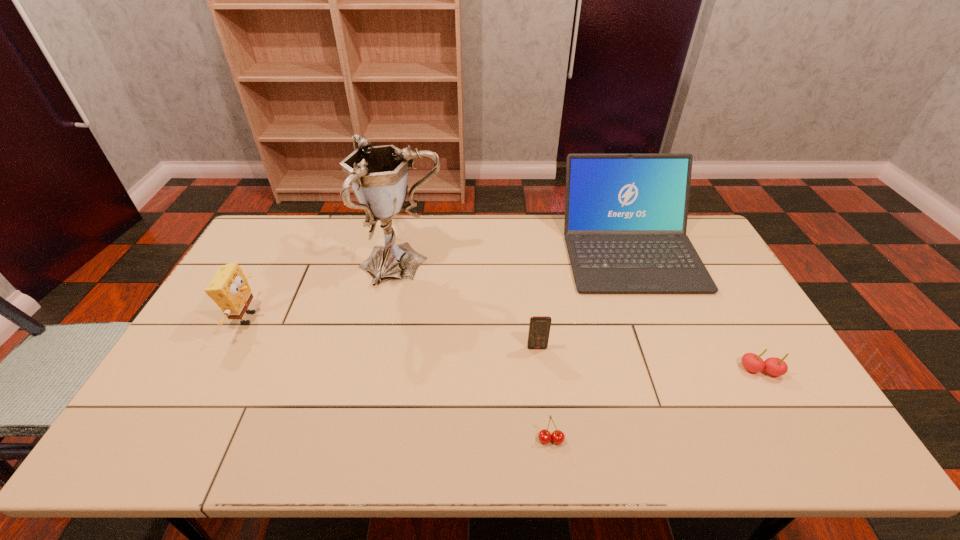
This screenshot has height=540, width=960. What are the coordinates of `free location located 0.170m on the right of the fifth object from right to left` in the screenshot? It's located at (496, 265).

This screenshot has width=960, height=540. Find the location of `free space located on the screen of the fifth shortest object`. free space located on the screen of the fifth shortest object is located at coordinates (660, 327).

You are a GUI agent. You are given a task and a screenshot of the screen. Output one action in this format:
    pyautogui.click(x=<x>, y=<y>)
    Task: Click on the vacant space located 0.360m on the face of the sponge
    
    Given the screenshot: What is the action you would take?
    pyautogui.click(x=384, y=318)

Identify the location of free spot located 0.180m on the screen of the cellular telephone. (544, 408).

This screenshot has width=960, height=540. What are the coordinates of `vacant region located on the left of the second nearest object` in the screenshot? It's located at (642, 370).

I want to click on trophy cup that is at the far edge, so click(x=378, y=175).

What are the coordinates of `laptop computer located at the far edge` in the screenshot? It's located at (625, 225).

Identify the location of object that is positioned at the near edge. The width and height of the screenshot is (960, 540). (545, 436).

Locate an element on the screen. This screenshot has width=960, height=540. object present at the left edge is located at coordinates (229, 289).

Where is `laptop computer that is at the right edge`? This screenshot has height=540, width=960. laptop computer that is at the right edge is located at coordinates (625, 225).